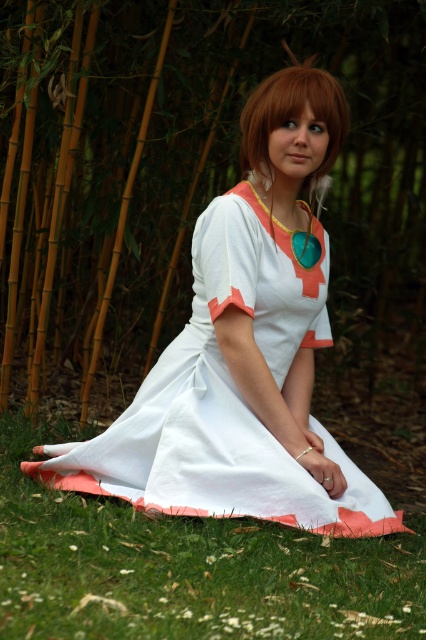
You are a photographer setting up a shot of the person in the white cotton dress at center and the blonde hair at center. Based on the scene, which object is positioned higher up in the image?

The white cotton dress at center is much taller as blonde hair at center, so the white cotton dress at center is positioned higher up in the image.

You are planning to take a photo of the white cotton dress at center and the green grass at lower center. Which object appears narrower in the image?

The white cotton dress at center appears narrower than the green grass at lower center because it has a lesser width according to the description.

You are a fashion designer observing the scene. You need to determine if the white cotton dress at center can be fully visible when placed on a mannequin standing on the green grass at lower center. Based on their sizes, what do you think?

The white cotton dress at center has a larger size compared to green grass at lower center, so the dress will be fully visible when placed on the mannequin standing on the green grass at lower center.